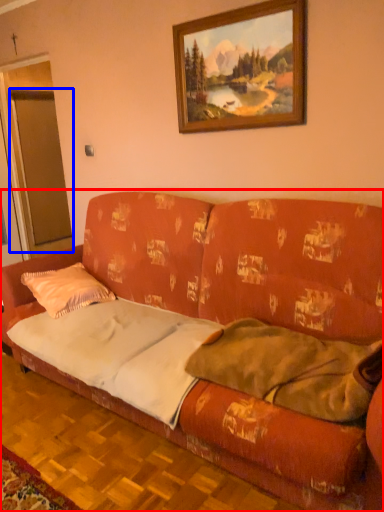
Question: Which object is further to the camera taking this photo, studio couch (highlighted by a red box) or glass door (highlighted by a blue box)?

Choices:
 (A) studio couch
 (B) glass door

Answer: (B)